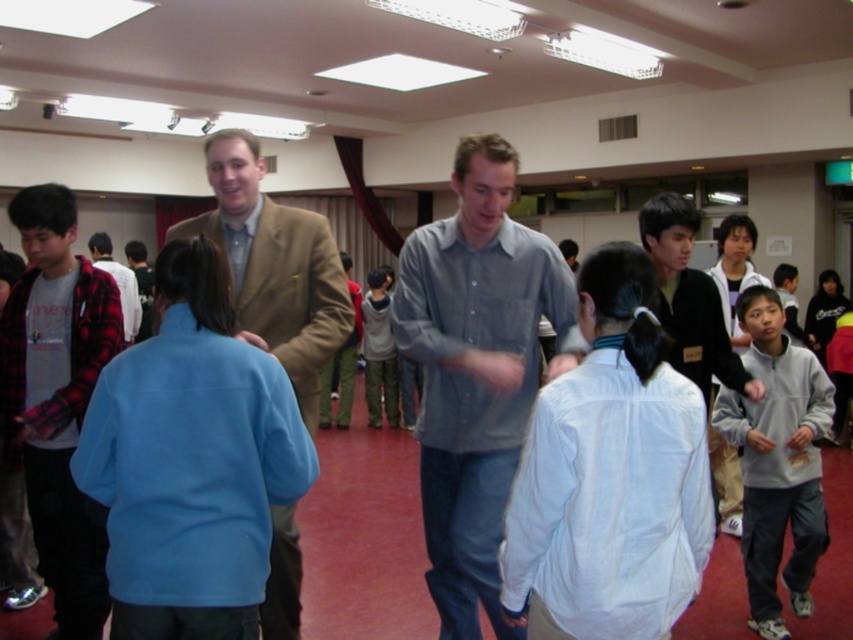
Is flannel shirt at left above light gray sweater at center?

No.

Who is positioned more to the left, flannel shirt at left or light gray sweater at center?

flannel shirt at left is more to the left.

The image size is (853, 640). I want to click on flannel shirt at left, so click(16, 540).

Which is below, white matte shirt at center or gray cotton shirt at center?

gray cotton shirt at center is below.

Does point (643, 460) come farther from viewer compared to point (521, 260)?

No, (643, 460) is in front of (521, 260).

Find the location of a particular element. The height and width of the screenshot is (640, 853). white matte shirt at center is located at coordinates (610, 476).

Is point (233, 156) positioned behind point (114, 268)?

No, it is not.

Which is more to the right, matte brown blazer at center or plaid flannel shirt at left?

matte brown blazer at center is more to the right.

Describe the element at coordinates (274, 266) in the screenshot. The image size is (853, 640). I see `matte brown blazer at center` at that location.

In order to click on matte brown blazer at center in this screenshot , I will do `click(274, 266)`.